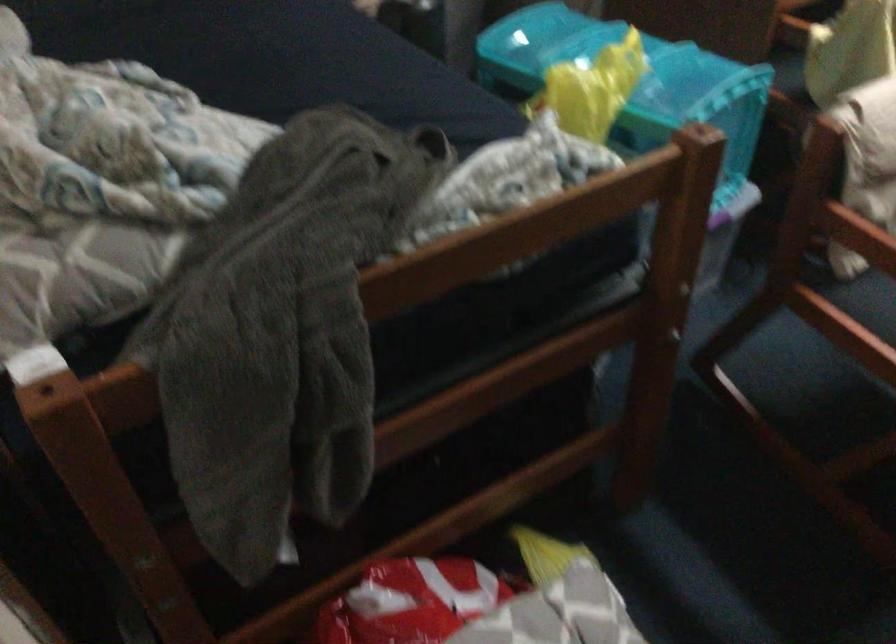
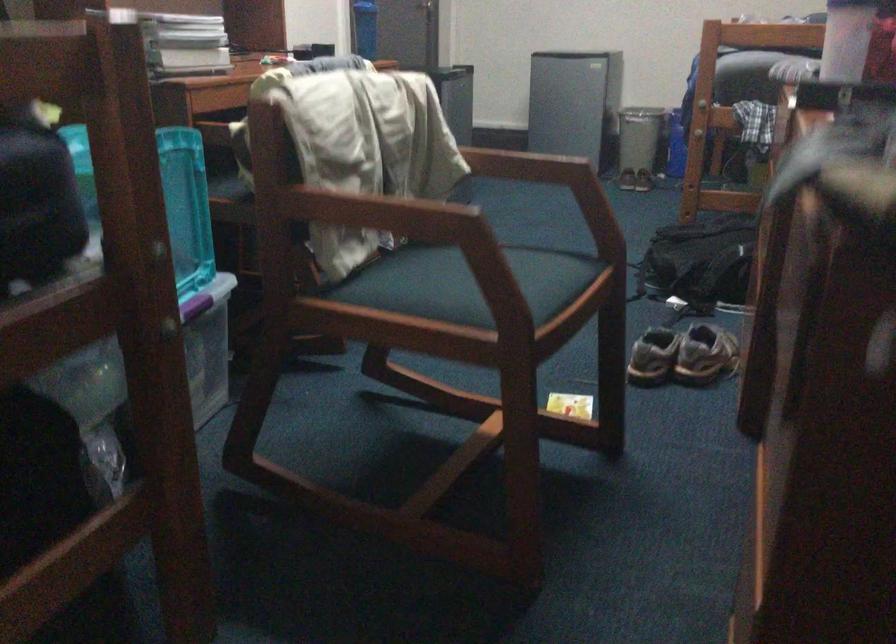
Question: Based on the continuous images, in which direction is the camera rotating? Reply with the corresponding letter.

Choices:
 (A) Left
 (B) Right
 (C) Up
 (D) Down

Answer: (B)